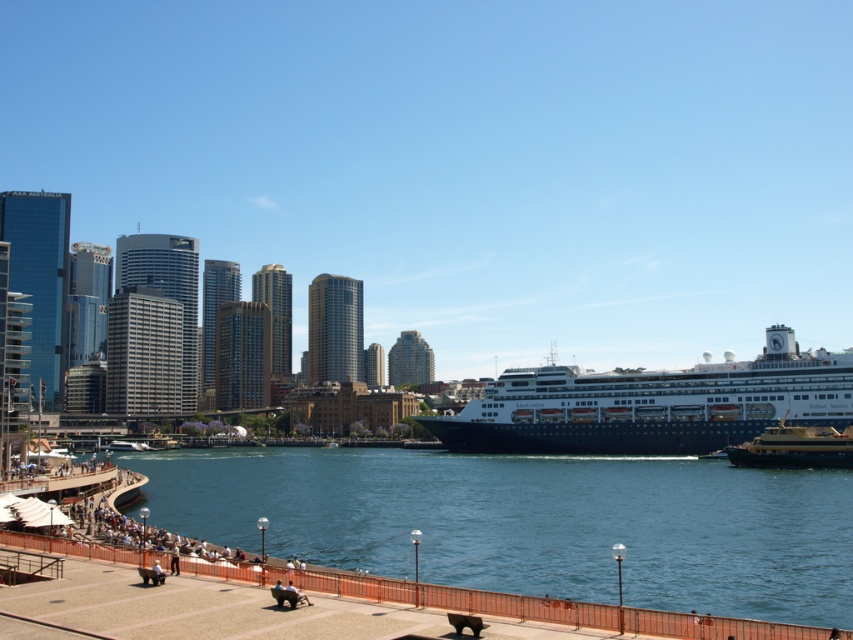
Who is lower down, blue glossy cruise ship at center or gold polished metal ferry at center?

gold polished metal ferry at center

Does point (758, 432) lie in front of point (817, 440)?

No, (758, 432) is behind (817, 440).

Does point (509, 420) come farther from viewer compared to point (839, 456)?

Yes, point (509, 420) is farther from viewer.

The image size is (853, 640). Find the location of `blue glossy cruise ship at center`. blue glossy cruise ship at center is located at coordinates (653, 404).

Who is positioned more to the right, blue water at lower center or gold polished metal ferry at center?

gold polished metal ferry at center

Is point (676, 500) positioned in front of point (770, 458)?

Yes.

Looking at this image, who is more forward, (x=363, y=474) or (x=791, y=460)?

Point (x=791, y=460)

Locate an element on the screen. blue water at lower center is located at coordinates (531, 522).

This screenshot has width=853, height=640. I want to click on blue water at lower center, so click(x=531, y=522).

Does point (399, 486) come behind point (762, 413)?

That is False.

Measure the distance between blue water at lower center and camera.

A distance of 43.70 meters exists between blue water at lower center and camera.

The height and width of the screenshot is (640, 853). What are the coordinates of `blue water at lower center` in the screenshot? It's located at (531, 522).